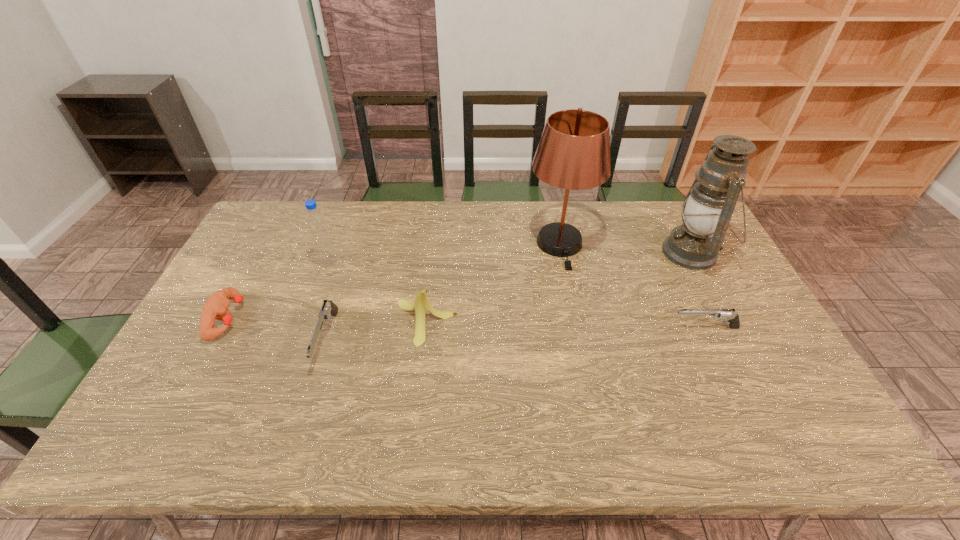
Where is `free space located 0.070m on the front-facing side of the third shortest object`? The height and width of the screenshot is (540, 960). free space located 0.070m on the front-facing side of the third shortest object is located at coordinates (308, 400).

At what (x,y) coordinates should I click in order to perform the action: click on free space located on the front-facing side of the shorter pistol. Please return your answer as a coordinate pair (x, y). This screenshot has height=540, width=960. Looking at the image, I should click on (549, 328).

Where is `free region located on the front-facing side of the shorter pistol`? The height and width of the screenshot is (540, 960). free region located on the front-facing side of the shorter pistol is located at coordinates (614, 328).

The height and width of the screenshot is (540, 960). What are the coordinates of `vacant space situated 0.160m on the front-facing side of the shorter pistol` in the screenshot? It's located at (614, 328).

Where is `free spot located 0.070m on the front-facing side of the lampshade`? This screenshot has height=540, width=960. free spot located 0.070m on the front-facing side of the lampshade is located at coordinates (568, 287).

At what (x,y) coordinates should I click in order to perform the action: click on free region located 0.380m on the left of the oil lamp. Please return your answer as a coordinate pair (x, y). This screenshot has width=960, height=540. Looking at the image, I should click on (548, 253).

Locate an element on the screen. vacant area situated on the back of the water bottle is located at coordinates (346, 214).

Find the location of a particular element. This screenshot has height=540, width=960. vacant space located 0.140m with the gloves of the puncher facing forward is located at coordinates (292, 319).

Identify the location of free space located 0.120m on the back of the banana. (431, 272).

Identify the location of lampshade at the far edge. Image resolution: width=960 pixels, height=540 pixels. [x=573, y=153].